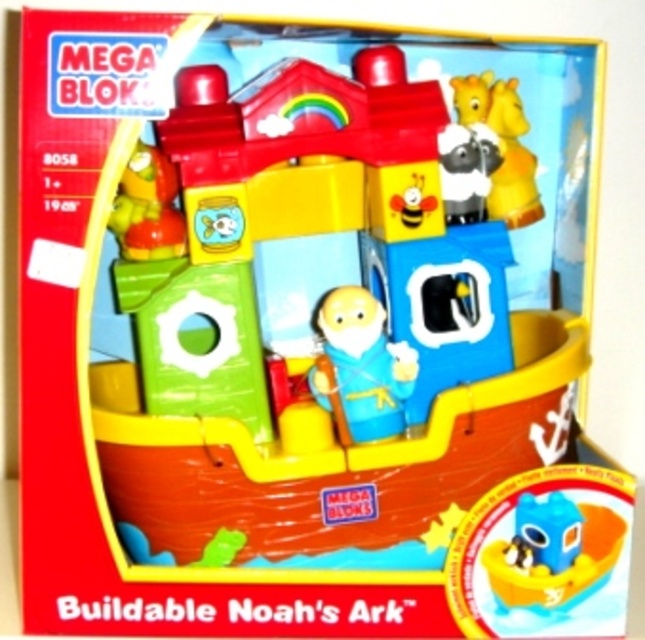
You are a parent looking at the Buildable Noahs Ark toy set box. You see the smooth plastic pirate hat at upper left and the white plush sheep at upper center. Which object on the box is bigger?

The smooth plastic pirate hat at upper left is larger in size than the white plush sheep at upper center.

You are a parent trying to decide whether to buy this toy set for your child. The smooth plastic pirate hat at upper left and the white plush sheep at upper center are both featured on the box. If your child wants to reach both items, how far apart are they on the packaging?

The smooth plastic pirate hat at upper left is 13.63 inches away from the white plush sheep at upper center, so they are 13.63 inches apart on the packaging.